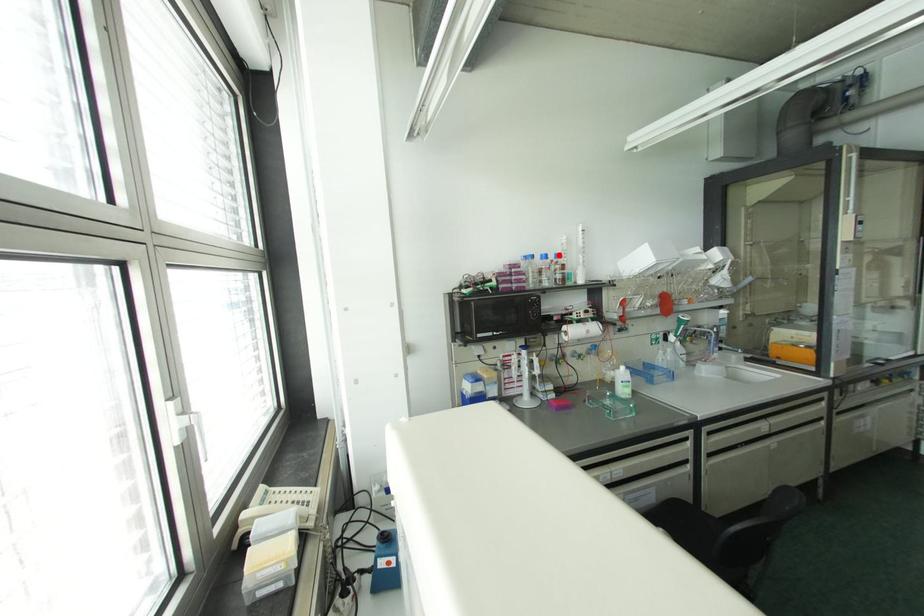
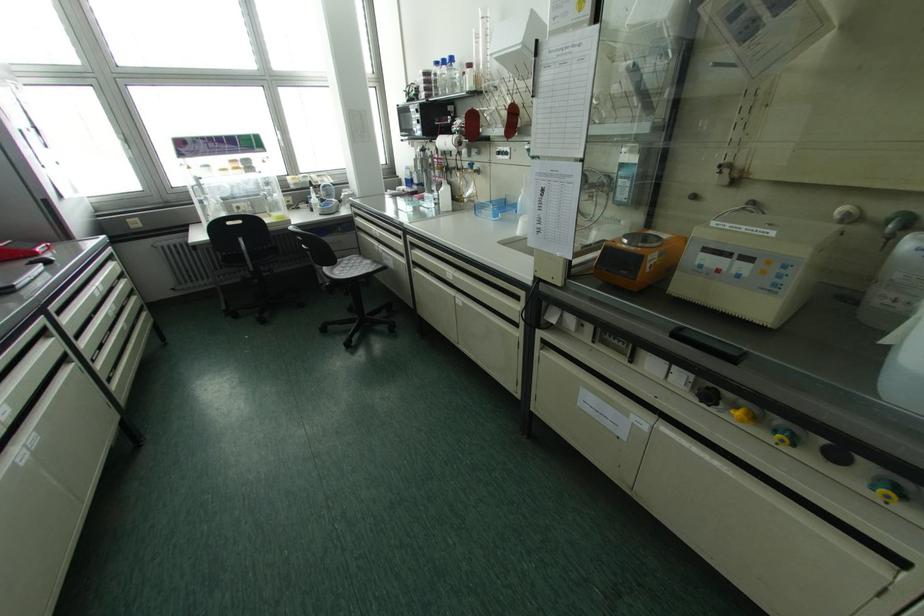
In the second image, find the point that corresponds to the highlighted location in the first image.

(451, 59)